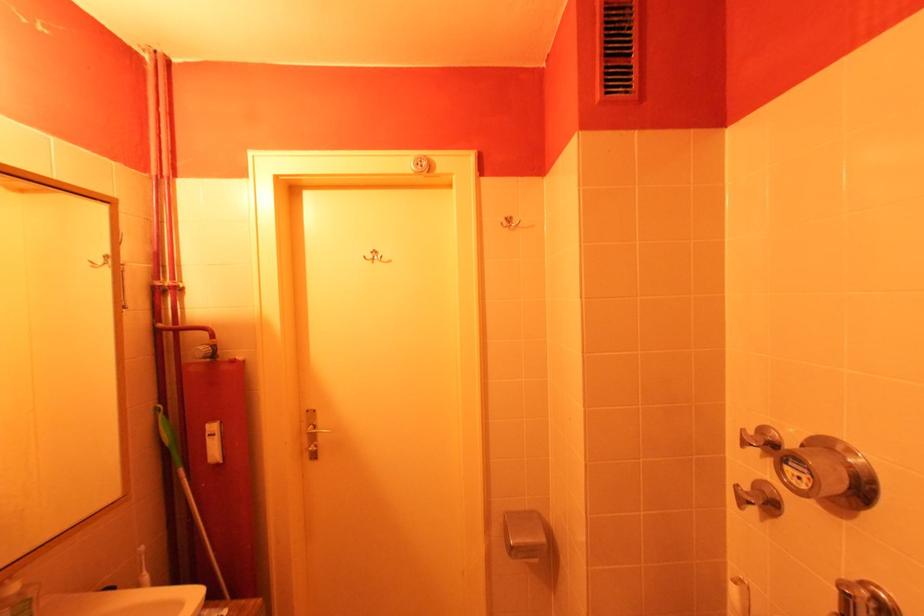
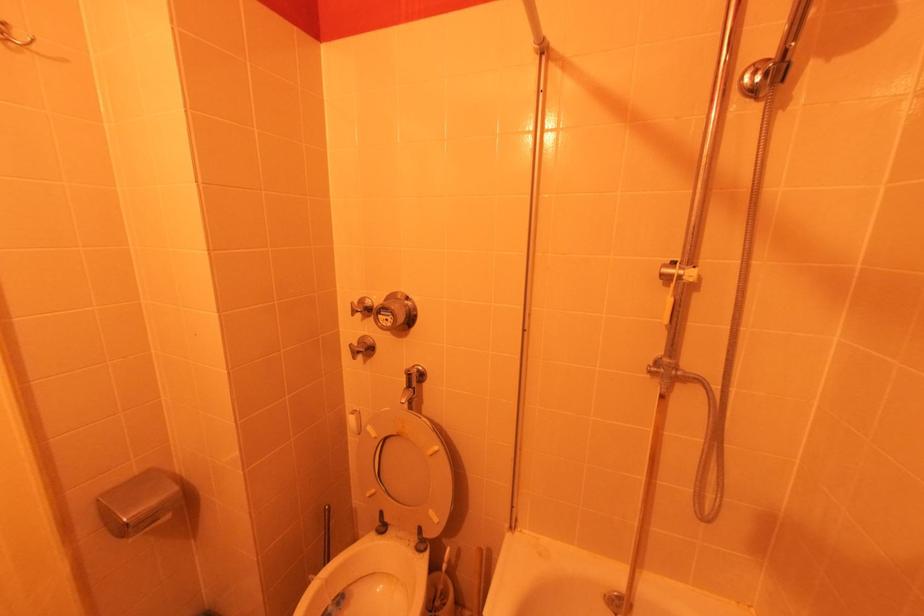
Question: The camera is either moving clockwise (left) or counter-clockwise (right) around the object. The first image is from the beginning of the video and the second image is from the end. Is the camera moving left or right when shooting the video?

Choices:
 (A) Left
 (B) Right

Answer: (A)